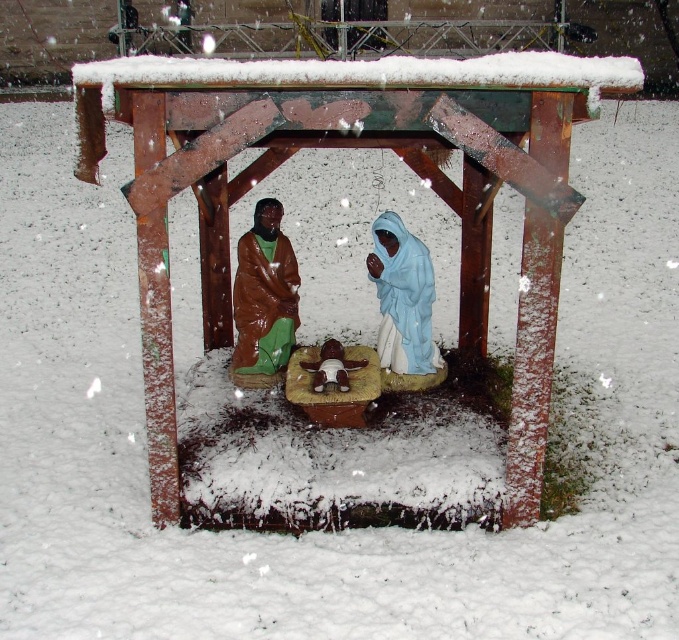
Question: Which point is closer to the camera?

Choices:
 (A) (380, 264)
 (B) (274, 333)

Answer: (A)

Question: Does light blue fabric at center lie behind brown matte robe at center?

Choices:
 (A) yes
 (B) no

Answer: (B)

Question: Which of the following is the farthest from the observer?

Choices:
 (A) (242, 346)
 (B) (430, 284)

Answer: (A)

Question: Does light blue fabric at center appear on the right side of brown matte robe at center?

Choices:
 (A) no
 (B) yes

Answer: (B)

Question: Is light blue fabric at center in front of brown matte robe at center?

Choices:
 (A) yes
 (B) no

Answer: (A)